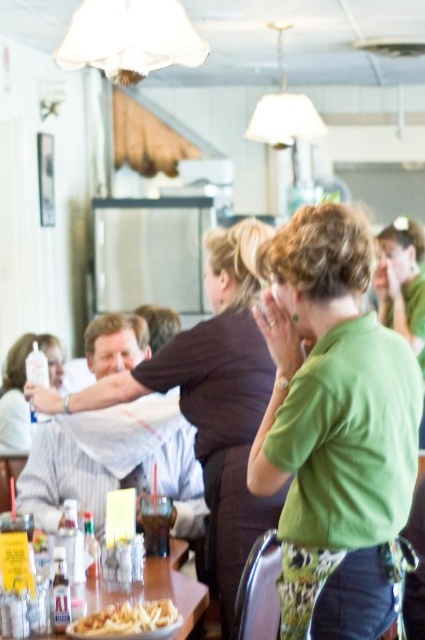
Question: From the image, what is the correct spatial relationship of green matte shirt at center in relation to golden crispy fries at lower left?

Choices:
 (A) above
 (B) below

Answer: (A)

Question: Which object is positioned farthest from the wooden table at lower left?

Choices:
 (A) matte brown shirt at center
 (B) green matte shirt at center

Answer: (B)

Question: Is green matte shirt at center below matte white bottle at left?

Choices:
 (A) no
 (B) yes

Answer: (A)

Question: Can you confirm if matte brown shirt at center is bigger than matte white bottle at left?

Choices:
 (A) no
 (B) yes

Answer: (B)

Question: Which point is farther to the camera?

Choices:
 (A) matte brown shirt at center
 (B) wooden table at lower left
 (C) golden crispy fries at lower left
 (D) matte white bottle at left

Answer: (D)

Question: Which object is the farthest from the matte brown shirt at center?

Choices:
 (A) matte white bottle at left
 (B) green matte shirt at center

Answer: (A)